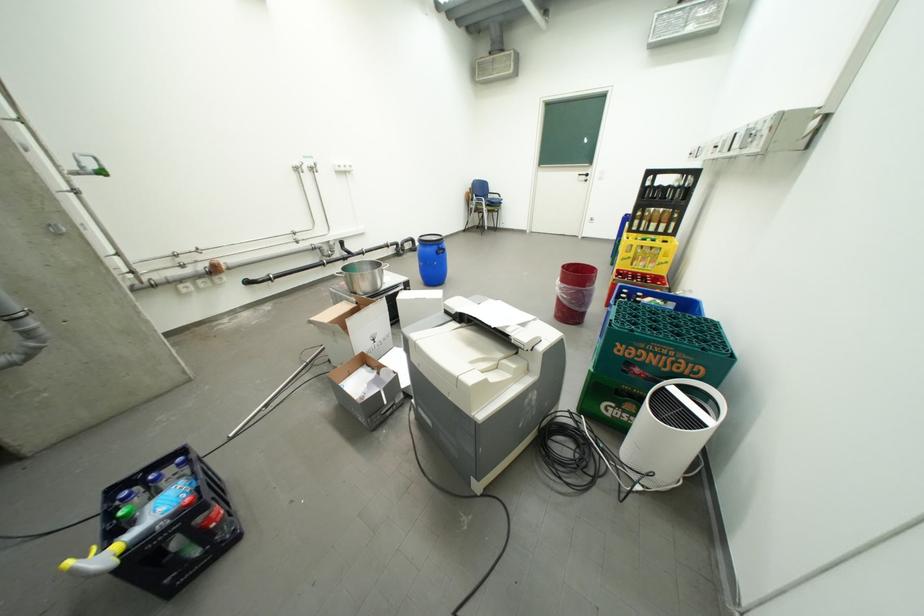
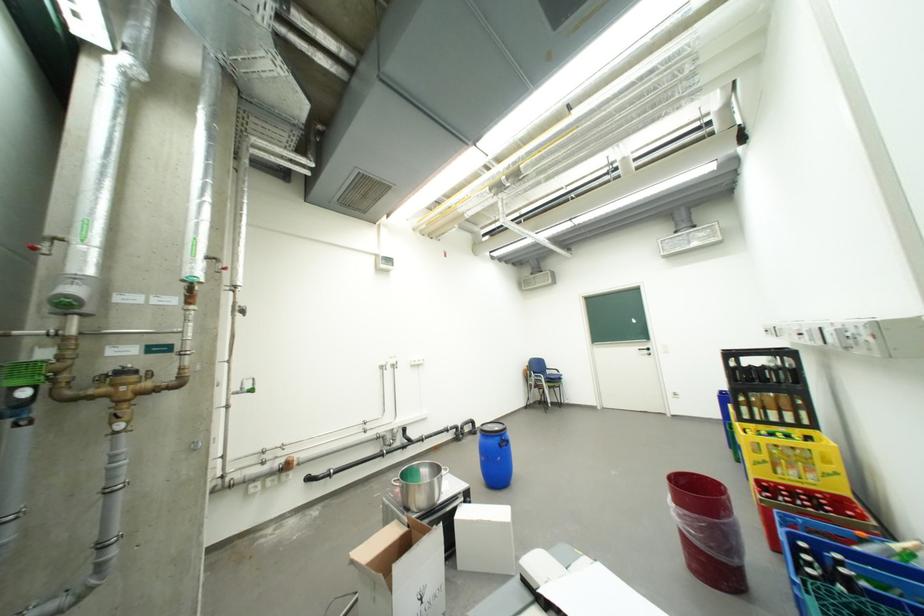
Where in the second image is the point corresponding to (570,284) from the first image?

(685, 507)